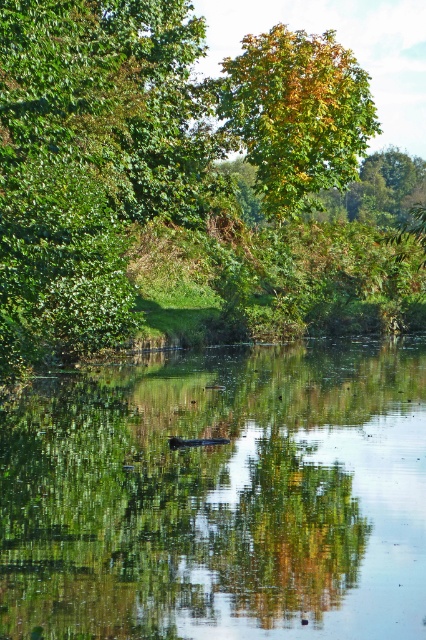
You are standing at the point labeled point [190,179] in the image. What object are you directly facing?

The point labeled point [190,179] corresponds to the green leafy tree at center, so you are directly facing the green leafy tree at center.

You are standing at the point with coordinates point (8, 115) and want to walk towards point (271, 157). Based on the scene description, will you be moving towards the water or away from it?

Since point (8, 115) is in front of point (271, 157), moving from point (8, 115) to point (271, 157) would mean moving away from the water towards the trees.